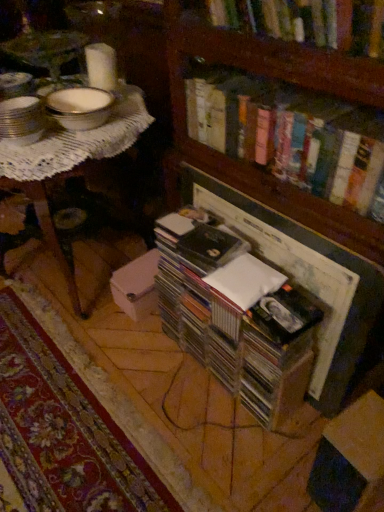
You are a GUI agent. You are given a task and a screenshot of the screen. Output one action in this format:
    pyautogui.click(x=<x>, y=<y>)
    Task: Click on the vacant point to the left of cardboard box at lower right
    
    Given the screenshot: What is the action you would take?
    pyautogui.click(x=279, y=471)